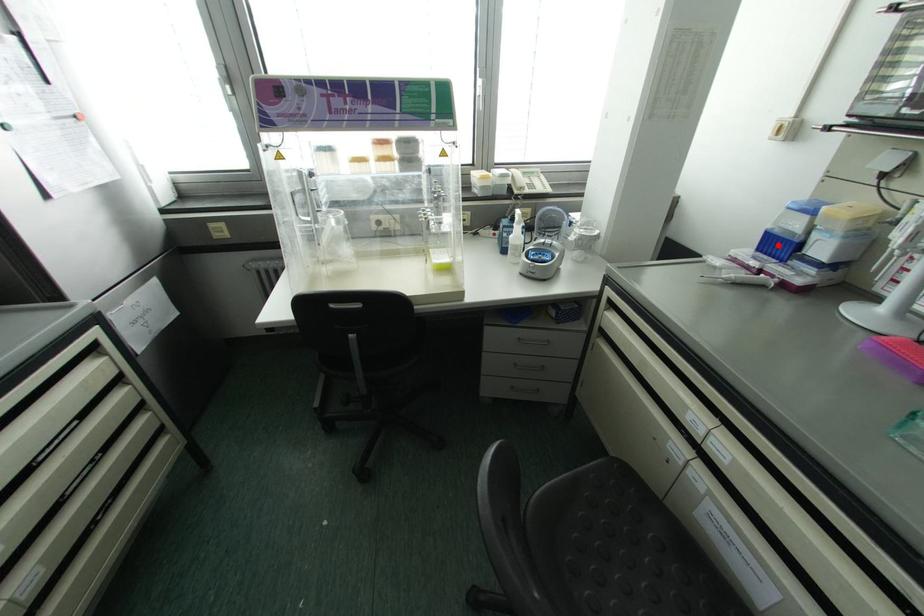
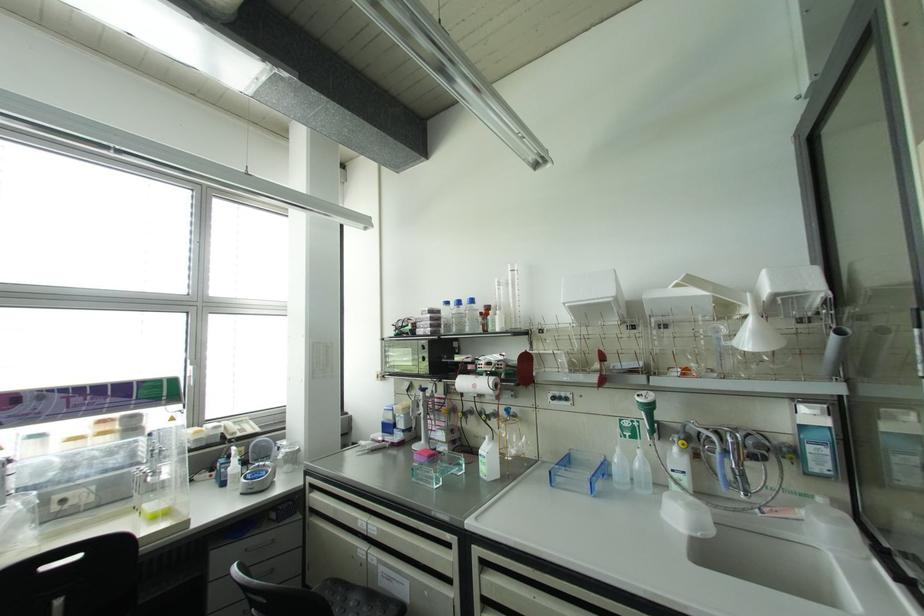
Question: I am providing you with two images of the same scene from different viewpoints. Image1 has a red point marked. In image2, the corresponding 3D location appears at what relative position? Reply with the corresponding letter.

Choices:
 (A) Closer
 (B) Farther

Answer: (B)